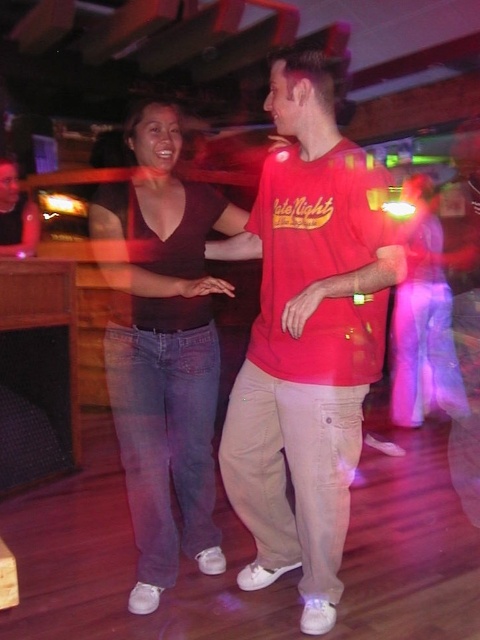
Question: Which object appears farthest from the camera in this image?

Choices:
 (A) matte red t-shirt at center
 (B) matte black tank top at center

Answer: (B)

Question: Where is matte red t-shirt at center located in relation to matte black tank top at center in the image?

Choices:
 (A) above
 (B) below

Answer: (A)

Question: Can you confirm if matte red t-shirt at center is smaller than matte black tank top at center?

Choices:
 (A) no
 (B) yes

Answer: (B)

Question: Is matte red t-shirt at center to the left of matte black tank top at center from the viewer's perspective?

Choices:
 (A) no
 (B) yes

Answer: (A)